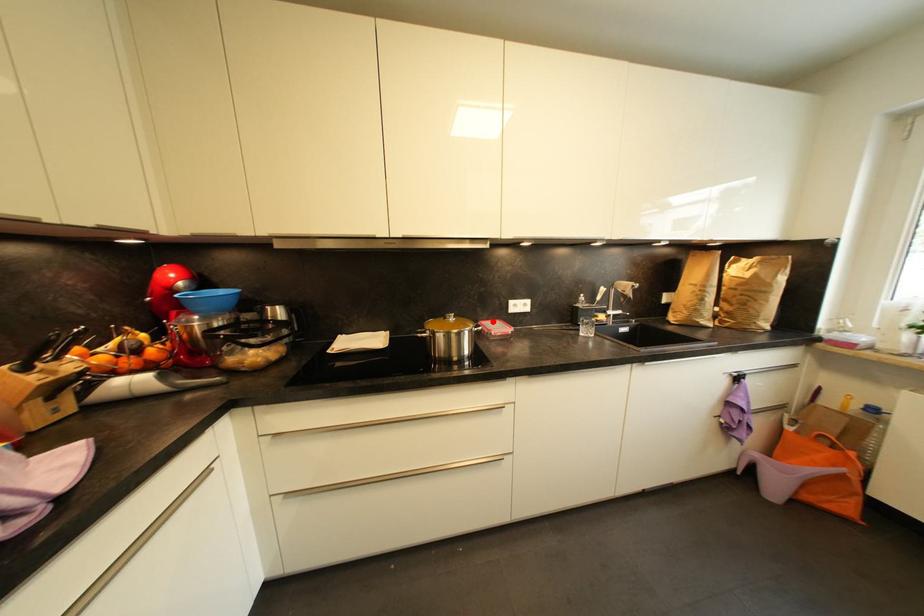
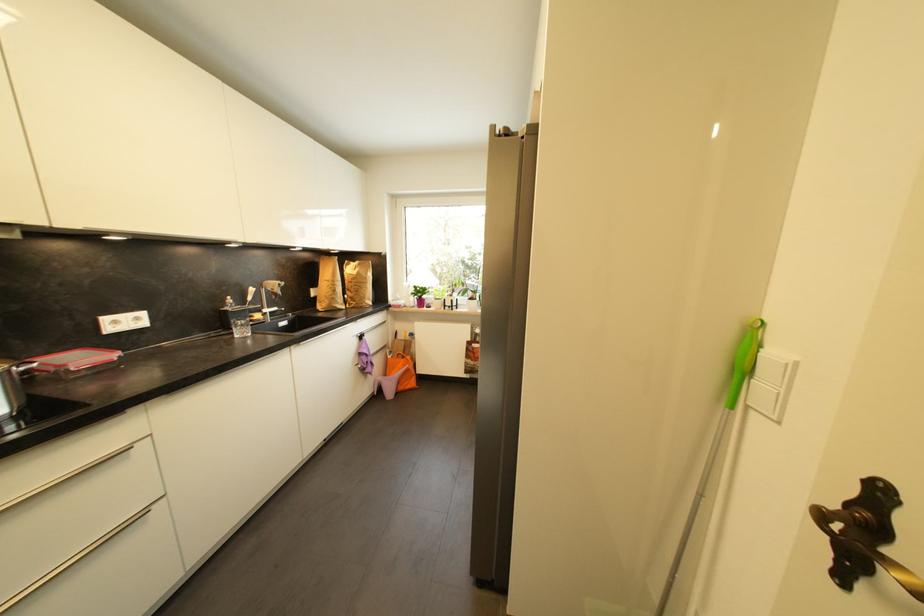
Question: A red point is marked in image1. In image2, is the corresponding 3D point closer to the camera or farther? Reply with the corresponding letter.

Choices:
 (A) The corresponding 3D point is closer.
 (B) The corresponding 3D point is farther.

Answer: (B)